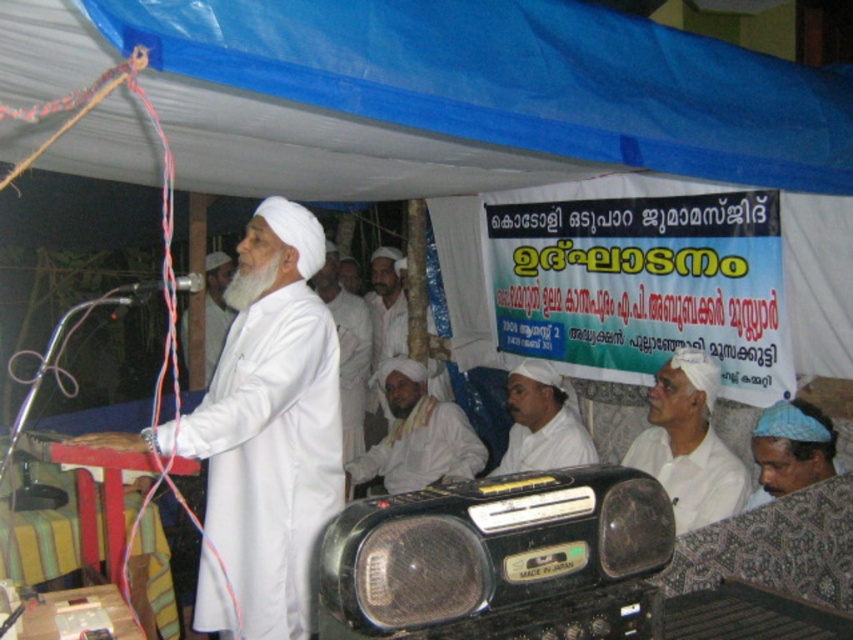
Question: Can you confirm if white matte shirt at lower right is wider than white clothed man at center?

Choices:
 (A) yes
 (B) no

Answer: (B)

Question: Which point appears farthest from the camera in this image?

Choices:
 (A) (659, 387)
 (B) (212, 298)

Answer: (B)

Question: Can you confirm if white matte/soft robe at center is positioned above white matte shirt at lower right?

Choices:
 (A) yes
 (B) no

Answer: (A)

Question: Estimate the real-world distances between objects in this image. Which object is closer to the blue fabric cap at lower right?

Choices:
 (A) white clothed man at center
 (B) white matte turban at center
 (C) white cloth at center
 (D) white matte/silk turban at upper center

Answer: (A)

Question: Which point is farther to the camera?

Choices:
 (A) (387, 369)
 (B) (717, 461)
 (C) (368, 316)
 (D) (570, 460)

Answer: (C)

Question: Considering the relative positions of blue fabric cap at lower right and white cloth at center in the image provided, where is blue fabric cap at lower right located with respect to white cloth at center?

Choices:
 (A) above
 (B) below

Answer: (B)